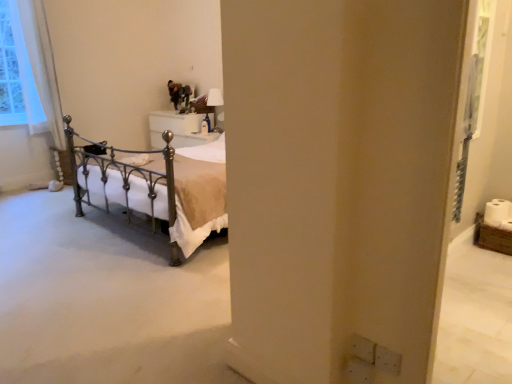
Find the location of a particular element. white glossy nightstand at center is located at coordinates (178, 129).

This screenshot has height=384, width=512. In order to click on white glossy lampshade at upper center in this screenshot , I will do `click(215, 98)`.

Do you think white glossy lampshade at upper center is within white glossy nightstand at center, or outside of it?

The correct answer is: outside.

How distant is white glossy lampshade at upper center from white glossy nightstand at center?

25.29 inches.

Is the surface of white glossy lampshade at upper center in direct contact with white glossy nightstand at center?

white glossy lampshade at upper center is not next to white glossy nightstand at center, and they're not touching.

Looking at this image, is white glossy lampshade at upper center facing towards white glossy nightstand at center?

No, white glossy lampshade at upper center is not turned towards white glossy nightstand at center.

From the image's perspective, relative to white sheer curtain at left, is white glossy nightstand at center above or below?

Based on their image positions, white glossy nightstand at center is located beneath white sheer curtain at left.

Consider the image. In the image, is white glossy nightstand at center positioned in front of or behind white sheer curtain at left?

white glossy nightstand at center is behind white sheer curtain at left.

Consider the image. Is white glossy nightstand at center not inside white sheer curtain at left?

That's correct, white glossy nightstand at center is outside of white sheer curtain at left.

Is white glossy nightstand at center turned away from white sheer curtain at left?

No, white glossy nightstand at center is not facing the opposite direction of white sheer curtain at left.

Which is in front, white sheer curtain at left or white glossy nightstand at center?

white sheer curtain at left.

What's the angular difference between white sheer curtain at left and white glossy nightstand at center's facing directions?

white sheer curtain at left and white glossy nightstand at center are facing 88.4 degrees away from each other.

How much distance is there between white sheer curtain at left and white glossy nightstand at center?

The distance of white sheer curtain at left from white glossy nightstand at center is 4.96 feet.

From a real-world perspective, which object rests below the other?

In real-world perspective, white glossy nightstand at center is lower.

Is white sheer curtain at left at the back of white glossy lampshade at upper center?

No, white glossy lampshade at upper center is not facing the opposite direction of white sheer curtain at left.

From the picture: Considering the sizes of objects white glossy lampshade at upper center and white sheer curtain at left in the image provided, who is bigger, white glossy lampshade at upper center or white sheer curtain at left?

white sheer curtain at left is bigger.

Considering the positions of objects white glossy lampshade at upper center and white sheer curtain at left in the image provided, who is in front, white glossy lampshade at upper center or white sheer curtain at left?

Positioned in front is white sheer curtain at left.

Would you say white glossy lampshade at upper center contains white sheer curtain at left?

No, white sheer curtain at left is not inside white glossy lampshade at upper center.

Consider the image. Considering the relative positions of white sheer curtain at left and white glossy lampshade at upper center in the image provided, is white sheer curtain at left to the right of white glossy lampshade at upper center from the viewer's perspective?

In fact, white sheer curtain at left is to the left of white glossy lampshade at upper center.

Which object is closer to the camera, white sheer curtain at left or white glossy lampshade at upper center?

Positioned in front is white sheer curtain at left.

Is white sheer curtain at left spatially inside white glossy lampshade at upper center, or outside of it?

white sheer curtain at left is not enclosed by white glossy lampshade at upper center.

This screenshot has width=512, height=384. What are the coordinates of `curtain above the white glossy lampshade at upper center (from the image's perspective)` in the screenshot? It's located at (37, 69).

Could you tell me if white glossy nightstand at center is turned towards white glossy lampshade at upper center?

No, white glossy nightstand at center is not aimed at white glossy lampshade at upper center.

In the scene shown: Which is closer, (166, 122) or (207, 98)?

Clearly, point (166, 122) is closer to the camera than point (207, 98).

Is white glossy nightstand at center at the left side of white glossy lampshade at upper center?

Yes, white glossy nightstand at center is to the left of white glossy lampshade at upper center.

Are white glossy nightstand at center and white glossy lampshade at upper center far apart?

They are positioned close to each other.

What are the coordinates of `lamp on the right of white glossy nightstand at center` in the screenshot? It's located at (215, 98).

Find the location of a particular element. This screenshot has width=512, height=384. curtain above the white glossy nightstand at center (from a real-world perspective) is located at coordinates (37, 69).

When comparing their distances from white sheer curtain at left, does white glossy nightstand at center or white glossy lampshade at upper center seem further?

white glossy lampshade at upper center lies further to white sheer curtain at left than the other object.

Which object lies nearer to the anchor point white sheer curtain at left, white glossy lampshade at upper center or white glossy nightstand at center?

white glossy nightstand at center lies closer to white sheer curtain at left than the other object.

When comparing their distances from white glossy nightstand at center, does white sheer curtain at left or white glossy lampshade at upper center seem further?

Based on the image, white sheer curtain at left appears to be further to white glossy nightstand at center.

Looking at the image, which one is located further to white glossy nightstand at center, white glossy lampshade at upper center or white sheer curtain at left?

white sheer curtain at left lies further to white glossy nightstand at center than the other object.

Considering their positions, is white sheer curtain at left positioned further to white glossy lampshade at upper center than white glossy nightstand at center?

white sheer curtain at left is further to white glossy lampshade at upper center.

Estimate the real-world distances between objects in this image. Which object is further from white glossy lampshade at upper center, white glossy nightstand at center or white sheer curtain at left?

Among the two, white sheer curtain at left is located further to white glossy lampshade at upper center.

The width and height of the screenshot is (512, 384). In order to click on furniture situated between white sheer curtain at left and white glossy lampshade at upper center from left to right in this screenshot , I will do `click(178, 129)`.